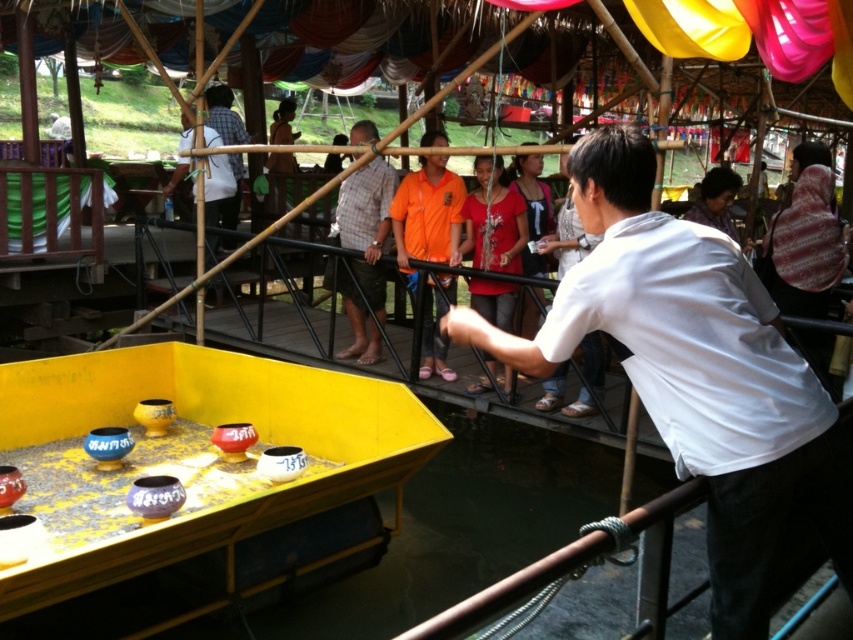
Question: Which object is farther from the camera taking this photo?

Choices:
 (A) orange fabric shirt at center
 (B) orange jersey at center
 (C) plaid fabric shirt at center
 (D) white matte shirt at center

Answer: (C)

Question: Is orange jersey at center wider than orange fabric shirt at center?

Choices:
 (A) yes
 (B) no

Answer: (A)

Question: Which point is closer to the camera taking this photo?

Choices:
 (A) (234, 541)
 (B) (422, 141)

Answer: (A)

Question: Where is white matte shirt at center located in relation to plaid fabric shirt at center in the image?

Choices:
 (A) right
 (B) left

Answer: (A)

Question: Does orange jersey at center have a smaller size compared to orange fabric shirt at center?

Choices:
 (A) no
 (B) yes

Answer: (A)

Question: Which is farther from the white matte shirt at center?

Choices:
 (A) plaid fabric shirt at center
 (B) orange jersey at center

Answer: (A)